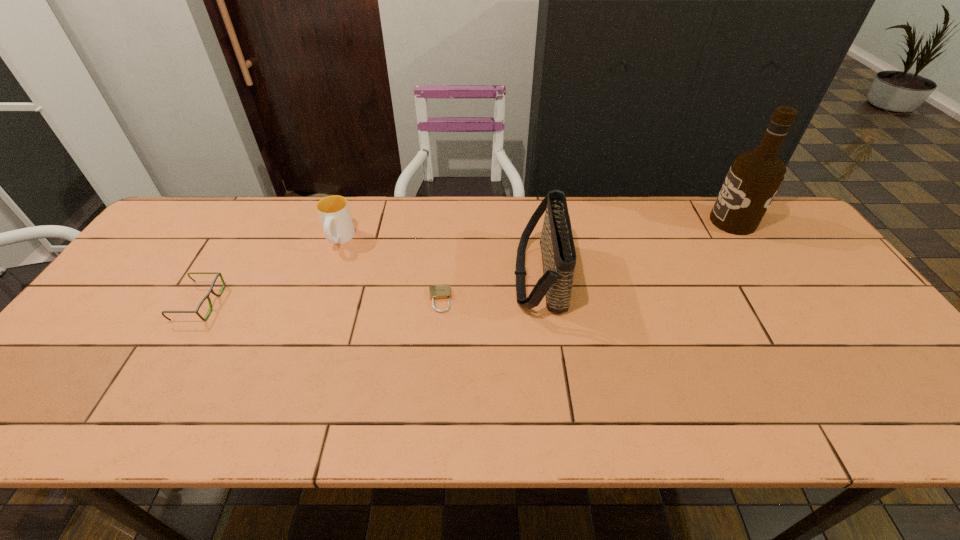
Where is `alcohol`? alcohol is located at coordinates pos(754,178).

Locate an element on the screen. The image size is (960, 540). the tallest object is located at coordinates (754, 178).

Where is `the fourth shortest object`? This screenshot has height=540, width=960. the fourth shortest object is located at coordinates 558,252.

Where is `handbag`? The width and height of the screenshot is (960, 540). handbag is located at coordinates (558, 252).

At what (x,y) coordinates should I click in order to perform the action: click on the second object from left to right. Please return your answer as a coordinate pair (x, y). The height and width of the screenshot is (540, 960). Looking at the image, I should click on (334, 213).

The width and height of the screenshot is (960, 540). What are the coordinates of `the third tallest object` in the screenshot? It's located at (334, 213).

The height and width of the screenshot is (540, 960). I want to click on the leftmost object, so click(x=207, y=297).

Find the location of a particular element. the second shortest object is located at coordinates (207, 297).

Where is `the shortest object`? The image size is (960, 540). the shortest object is located at coordinates (437, 292).

You are a GUI agent. You are given a task and a screenshot of the screen. Output one action in this format:
    pyautogui.click(x=<x>, y=<y>)
    Task: Click on the padlock
    The image size is (960, 540).
    Given the screenshot: What is the action you would take?
    pyautogui.click(x=437, y=292)